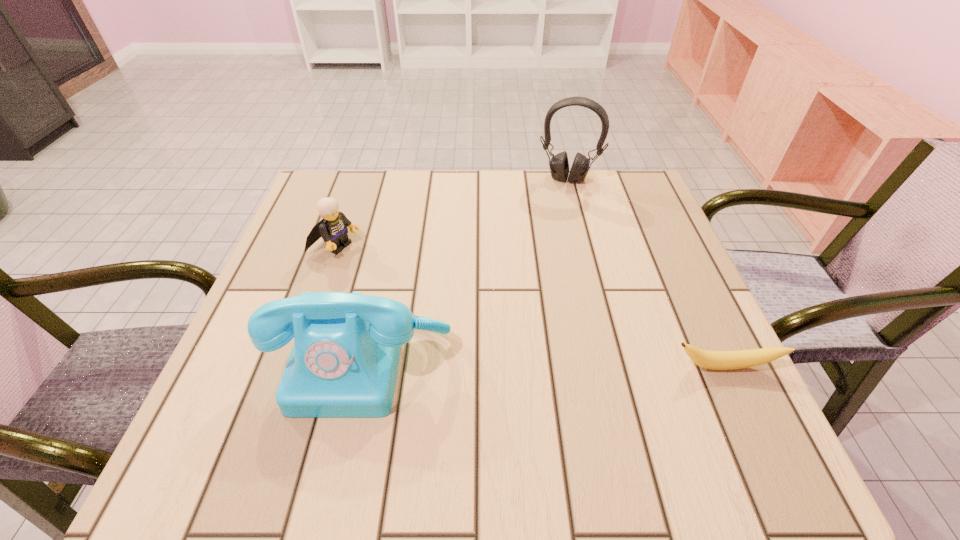
At what (x,y) coordinates should I click in order to perform the action: click on the third shortest object. Please return your answer as a coordinate pair (x, y). Looking at the image, I should click on (344, 361).

I want to click on banana, so click(715, 360).

You are a GUI agent. You are given a task and a screenshot of the screen. Output one action in this format:
    pyautogui.click(x=<x>, y=<y>)
    Task: Click on the rightmost object
    
    Given the screenshot: What is the action you would take?
    pyautogui.click(x=715, y=360)

This screenshot has width=960, height=540. In order to click on Lego in this screenshot , I will do `click(332, 228)`.

Where is `the third tallest object`? The width and height of the screenshot is (960, 540). the third tallest object is located at coordinates (332, 228).

I want to click on the third object from left to right, so click(x=559, y=166).

This screenshot has height=540, width=960. In order to click on the farthest object in this screenshot , I will do `click(559, 166)`.

You are a GUI agent. You are given a task and a screenshot of the screen. Output one action in this format:
    pyautogui.click(x=<x>, y=<y>)
    Task: Click on the vacant space located on the upward curve of the shortest object
    
    Given the screenshot: What is the action you would take?
    pyautogui.click(x=749, y=416)

Where is `vacant position located 0.160m on the front-facing side of the third tallest object`? The image size is (960, 540). vacant position located 0.160m on the front-facing side of the third tallest object is located at coordinates (411, 279).

Identify the location of free region located 0.120m on the front-facing side of the third tallest object. The height and width of the screenshot is (540, 960). (396, 272).